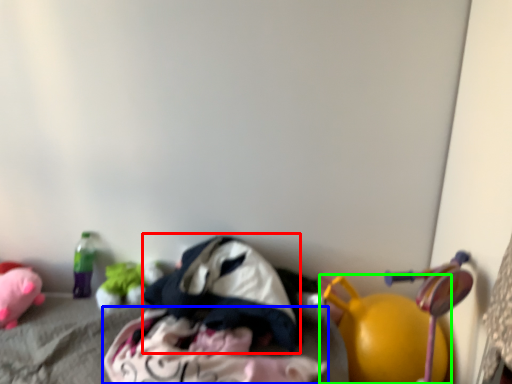
Question: Estimate the real-world distances between objects in this image. Which object is closer to clothing (highlighted by a red box), clothing (highlighted by a blue box) or toy (highlighted by a green box)?

Choices:
 (A) clothing
 (B) toy

Answer: (A)